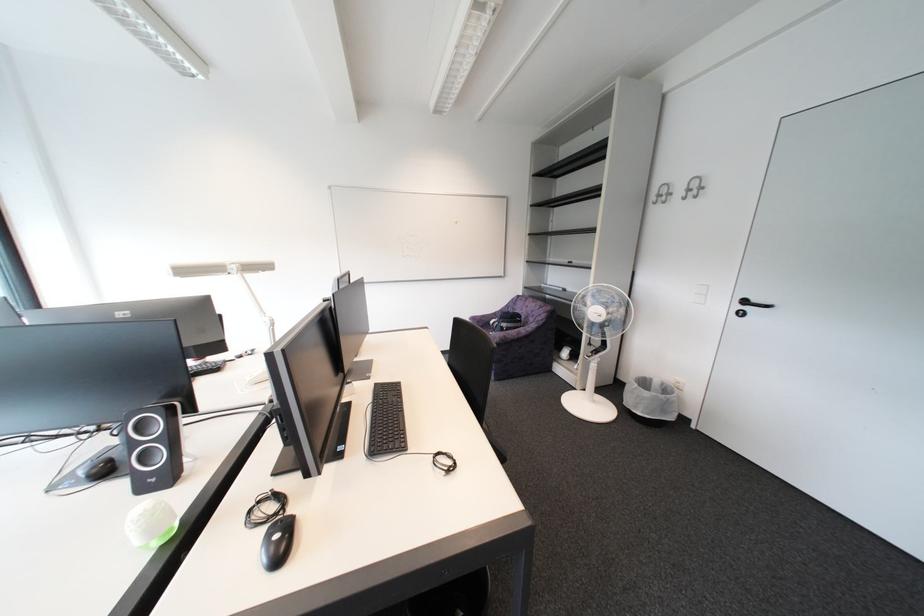
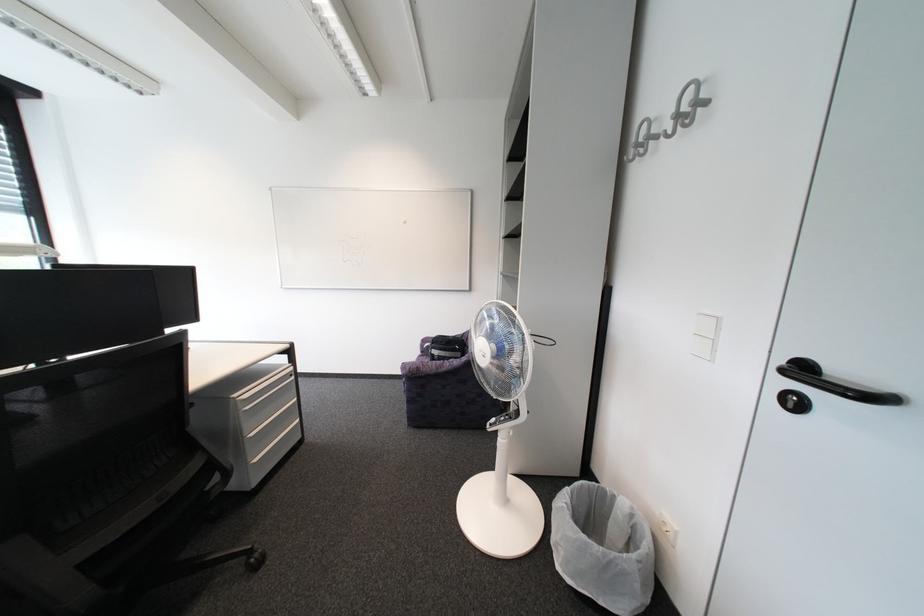
What movement of the cameraman would produce the second image?

The movement direction of the cameraman is right, forward.